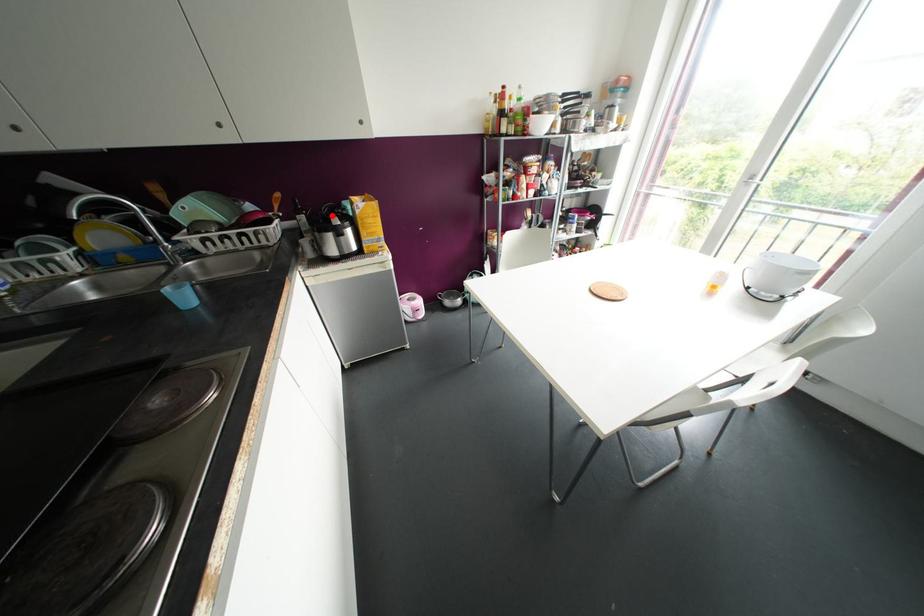
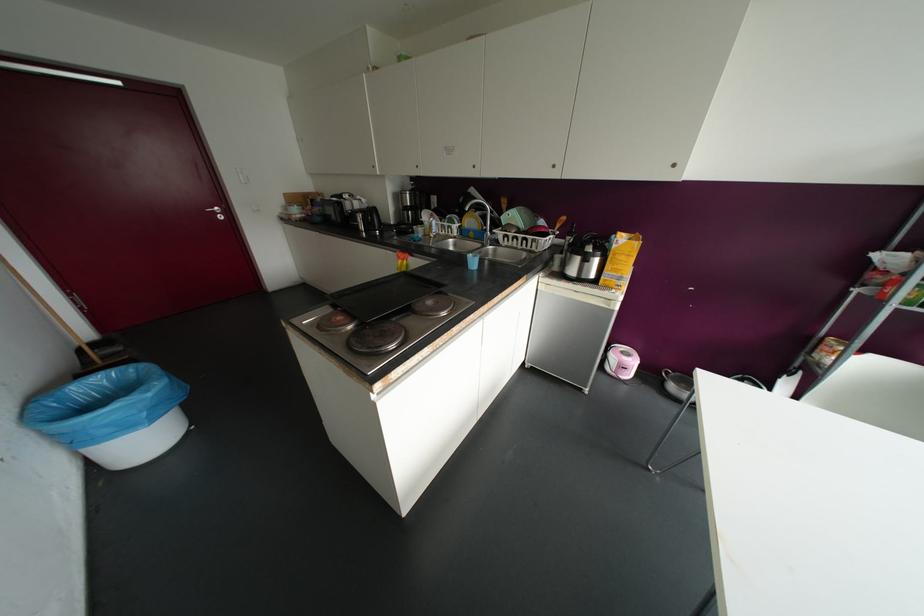
Locate, in the second image, the point that corresponds to the highlighted location in the first image.

(589, 244)